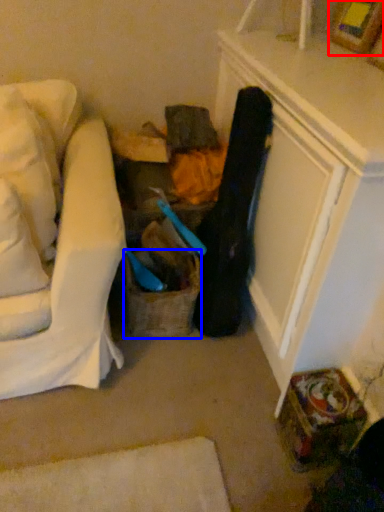
Question: Which object is further to the camera taking this photo, picture frame (highlighted by a red box) or basket (highlighted by a blue box)?

Choices:
 (A) picture frame
 (B) basket

Answer: (B)